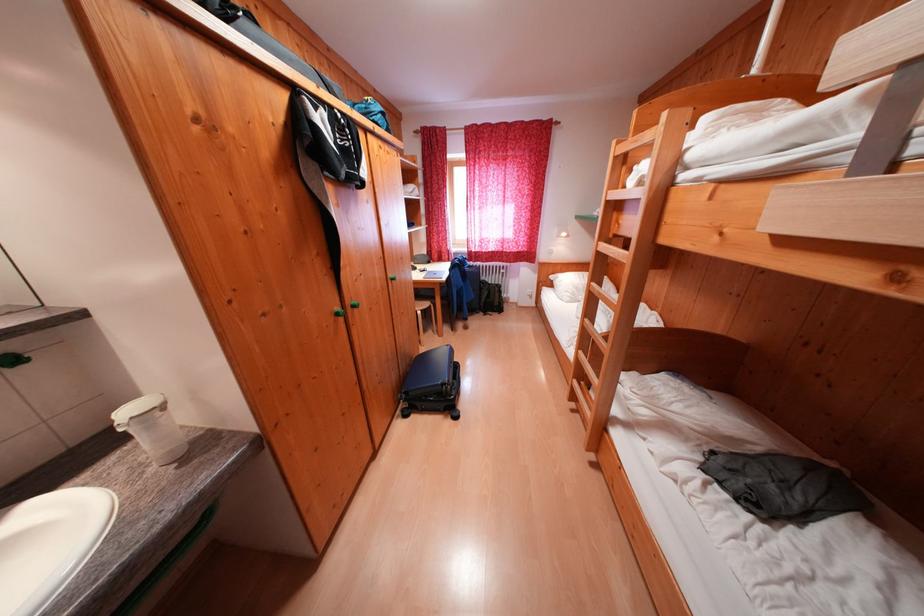
The height and width of the screenshot is (616, 924). What do you see at coordinates (529, 294) in the screenshot?
I see `the white light switch` at bounding box center [529, 294].